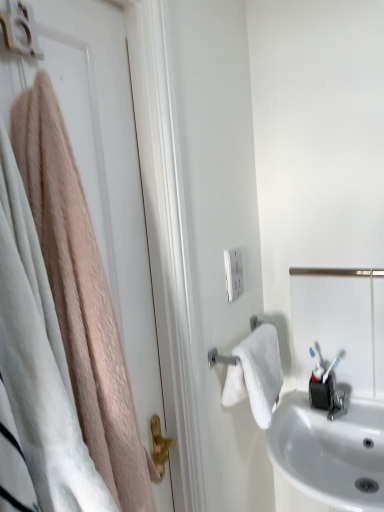
What is the approximate width of white matte door at left?

It is 3.18 inches.

This screenshot has height=512, width=384. I want to click on white glossy sink at lower right, so click(x=327, y=456).

Does white glossy sink at lower right have a greater width compared to white matte door at left?

Indeed, white glossy sink at lower right has a greater width compared to white matte door at left.

Is white matte door at left completely or partially inside white glossy sink at lower right?

Definitely not — white matte door at left is not inside white glossy sink at lower right.

Is point (310, 487) farther from camera compared to point (146, 316)?

That is True.

Is white glossy sink at lower right facing towards white matte door at left?

No.

Considering the points (308, 429) and (241, 292), which point is behind, point (308, 429) or point (241, 292)?

The point (308, 429) is farther from the camera.

Is white glossy sink at lower right directly adjacent to white plastic outlet at center?

No, white glossy sink at lower right is not touching white plastic outlet at center.

Is white glossy sink at lower right further to camera compared to white plastic outlet at center?

No, the depth of white glossy sink at lower right is less than that of white plastic outlet at center.

Is white glossy sink at lower right to the left or to the right of white plastic outlet at center in the image?

Clearly, white glossy sink at lower right is on the right of white plastic outlet at center in the image.

How many degrees apart are the facing directions of satin silver mirror at right and white matte door at left?

There is a 90.3-degree angle between the facing directions of satin silver mirror at right and white matte door at left.

Considering their positions, is satin silver mirror at right located in front of or behind white matte door at left?

Clearly, satin silver mirror at right is behind white matte door at left.

Between point (371, 381) and point (112, 69), which one is positioned behind?

The point (371, 381) is farther from the camera.

Who is smaller, satin silver mirror at right or white matte door at left?

satin silver mirror at right.

Can you tell me how much white plastic outlet at center and satin silver mirror at right differ in facing direction?

They differ by 89.5 degrees in their facing directions.

At what (x,y) coordinates should I click in order to perform the action: click on mirror behind the white plastic outlet at center. Please return your answer as a coordinate pair (x, y). Looking at the image, I should click on (340, 325).

Between white plastic outlet at center and satin silver mirror at right, which one has less height?

Standing shorter between the two is white plastic outlet at center.

Is white plastic outlet at center wider than satin silver mirror at right?

No, white plastic outlet at center is not wider than satin silver mirror at right.

Is white glossy sink at lower right far away from satin silver mirror at right?

They are positioned close to each other.

Is the position of white glossy sink at lower right less distant than that of satin silver mirror at right?

Yes, white glossy sink at lower right is closer to the viewer.

Between white glossy sink at lower right and satin silver mirror at right, which one has smaller width?

satin silver mirror at right is thinner.

In terms of height, does white glossy sink at lower right look taller or shorter compared to satin silver mirror at right?

Clearly, white glossy sink at lower right is taller compared to satin silver mirror at right.

From the image's perspective, between satin silver mirror at right and white glossy sink at lower right, which one is located above?

satin silver mirror at right.

Considering the relative sizes of satin silver mirror at right and white glossy sink at lower right in the image provided, is satin silver mirror at right smaller than white glossy sink at lower right?

Indeed, satin silver mirror at right has a smaller size compared to white glossy sink at lower right.

Is satin silver mirror at right inside or outside of white glossy sink at lower right?

satin silver mirror at right lies outside white glossy sink at lower right.

Considering the sizes of objects satin silver mirror at right and white glossy sink at lower right in the image provided, who is thinner, satin silver mirror at right or white glossy sink at lower right?

satin silver mirror at right.

You are a GUI agent. You are given a task and a screenshot of the screen. Output one action in this format:
    pyautogui.click(x=<x>, y=<y>)
    Task: Click on the mirror that is under the white matte door at left (from a real-world perspective)
    This screenshot has height=512, width=384.
    Given the screenshot: What is the action you would take?
    pyautogui.click(x=340, y=325)

From the picture: Which is closer, (154, 322) or (379, 349)?

Point (154, 322) appears to be closer to the viewer than point (379, 349).

From a real-world perspective, between white matte door at left and satin silver mirror at right, who is vertically higher?

From a 3D spatial view, white matte door at left is above.

Is white matte door at left directly adjacent to satin silver mirror at right?

There is a gap between white matte door at left and satin silver mirror at right.

Identify the location of sink located on the right of white matte door at left. This screenshot has width=384, height=512. (327, 456).

I want to click on light switch located behind the white glossy sink at lower right, so click(233, 274).

Estimate the real-world distances between objects in this image. Which object is closer to white plastic outlet at center, white glossy sink at lower right or white matte door at left?

white matte door at left lies closer to white plastic outlet at center than the other object.

Which object lies further to the anchor point white glossy sink at lower right, satin silver mirror at right or white matte door at left?

white matte door at left is further to white glossy sink at lower right.

Looking at the image, which one is located further to white matte door at left, white plastic outlet at center or white glossy sink at lower right?

white glossy sink at lower right.

Estimate the real-world distances between objects in this image. Which object is further from white plastic outlet at center, white matte door at left or satin silver mirror at right?

Based on the image, white matte door at left appears to be further to white plastic outlet at center.

From the image, which object appears to be farther from white glossy sink at lower right, white plastic outlet at center or satin silver mirror at right?

Among the two, white plastic outlet at center is located further to white glossy sink at lower right.

In the scene shown: Looking at the image, which one is located further to white glossy sink at lower right, white plastic outlet at center or white matte door at left?

white matte door at left.

Considering their positions, is white glossy sink at lower right positioned further to white plastic outlet at center than satin silver mirror at right?

The object further to white plastic outlet at center is white glossy sink at lower right.

Which object lies further to the anchor point white plastic outlet at center, satin silver mirror at right or white matte door at left?

Based on the image, white matte door at left appears to be further to white plastic outlet at center.

You are a GUI agent. You are given a task and a screenshot of the screen. Output one action in this format:
    pyautogui.click(x=<x>, y=<y>)
    Task: Click on the light switch between white matte door at left and satin silver mirror at right from front to back
    The image size is (384, 512).
    Given the screenshot: What is the action you would take?
    pyautogui.click(x=233, y=274)

The image size is (384, 512). What are the coordinates of `door between white plastic outlet at center and white glossy sink at lower right in the vertical direction` in the screenshot? It's located at (101, 164).

Locate an element on the screen. sink between white matte door at left and satin silver mirror at right along the z-axis is located at coordinates (327, 456).

Identify the location of mirror between white plastic outlet at center and white glossy sink at lower right in the up-down direction. (340, 325).